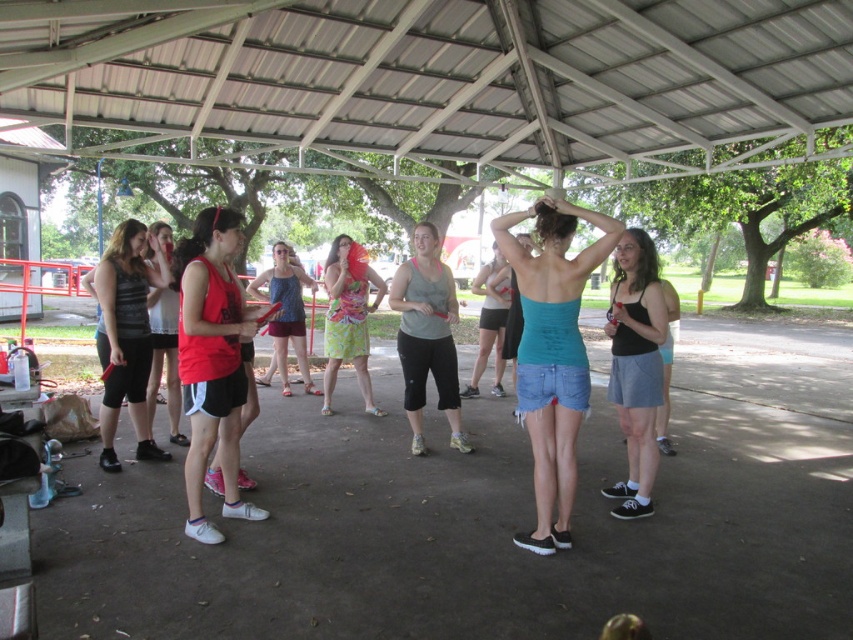
Is point (572, 444) more distant than point (366, 336)?

No.

Who is taller, teal fabric tank top at center or lime green floral dress at center?

With more height is teal fabric tank top at center.

Measure the distance between point (531, 403) and camera.

Point (531, 403) is 4.34 meters away from camera.

At what (x,y) coordinates should I click in order to perform the action: click on teal fabric tank top at center. Please return your answer as a coordinate pair (x, y). Looking at the image, I should click on (552, 353).

Is point (424, 330) less distant than point (334, 243)?

Yes, point (424, 330) is in front of point (334, 243).

Is gray matte tank top at center shorter than lime green floral dress at center?

Incorrect, gray matte tank top at center's height does not fall short of lime green floral dress at center's.

Which is in front, point (412, 305) or point (367, 275)?

Point (412, 305)

Where is `gray matte tank top at center`? gray matte tank top at center is located at coordinates (427, 336).

Is lime green floral dress at center to the left of matte red tank top at center from the viewer's perspective?

Incorrect, lime green floral dress at center is not on the left side of matte red tank top at center.

Is lime green floral dress at center bigger than matte red tank top at center?

Indeed, lime green floral dress at center has a larger size compared to matte red tank top at center.

Where is `lime green floral dress at center`? This screenshot has width=853, height=640. lime green floral dress at center is located at coordinates (347, 321).